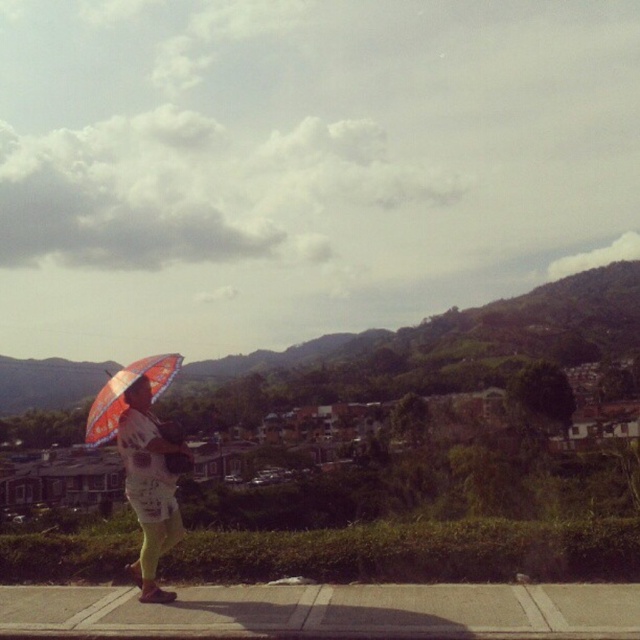
You are standing at the camera position and want to reach a specific point marked at coordinates point (572, 301). If your walking speed is 1.5 meters per second, how many seconds will it take you to reach that point?

The distance of point (572, 301) from camera is 64.43 meters. At a walking speed of 1.5 meters per second, it will take 64.43 divided by 1.5, which is approximately 42.95 seconds. So, it will take about 43 seconds to reach the point.

You are a photographer trying to capture the orange fabric umbrella at left while ensuring the green grassy hillside at upper center is visible in the background. Based on their sizes, which object should you focus on to ensure both are in the frame?

The green grassy hillside at upper center is larger than the orange fabric umbrella at left, so focusing on the hillside will help ensure both the umbrella and the hillside are in the frame since it occupies more space in the scene.